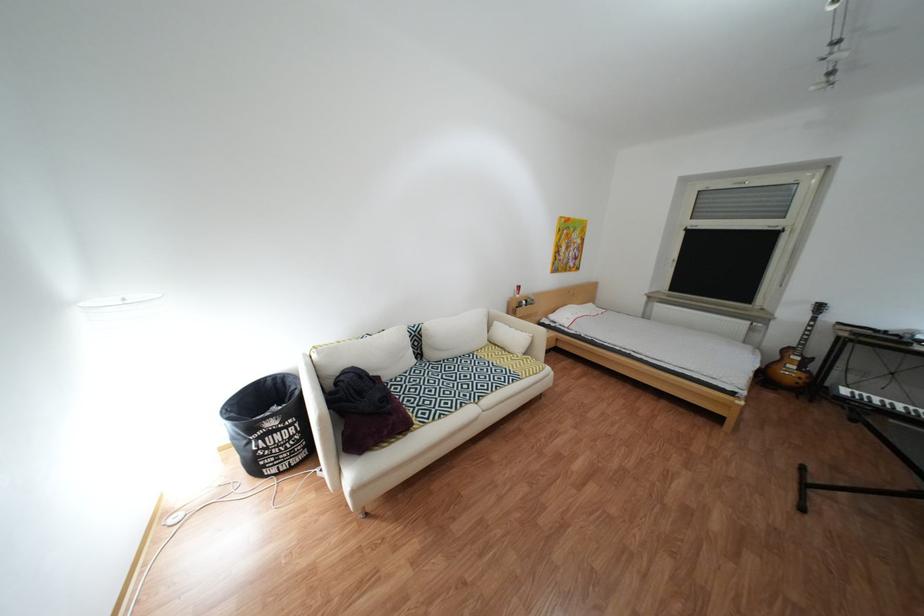
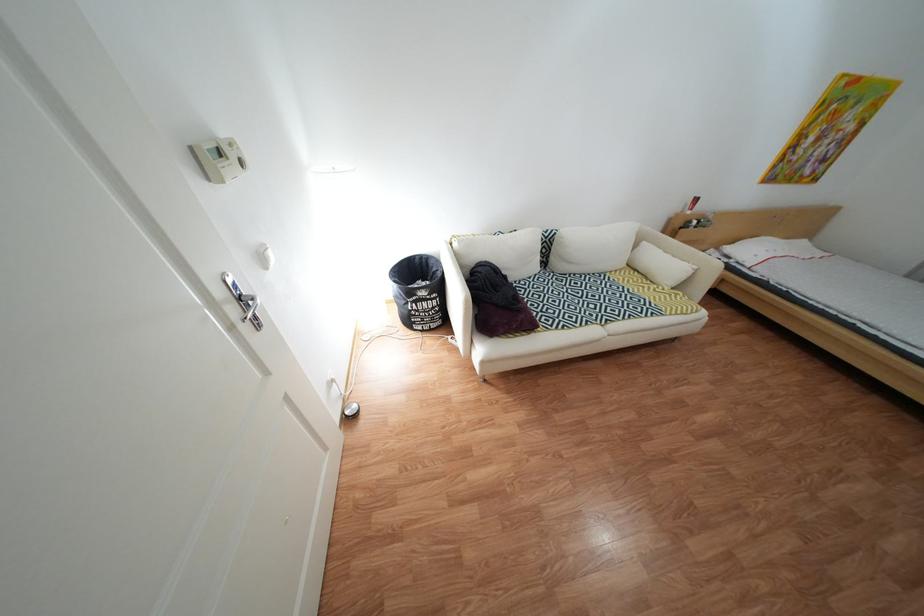
Find the pixel in the second image that matches [512,346] in the first image.

(651, 272)